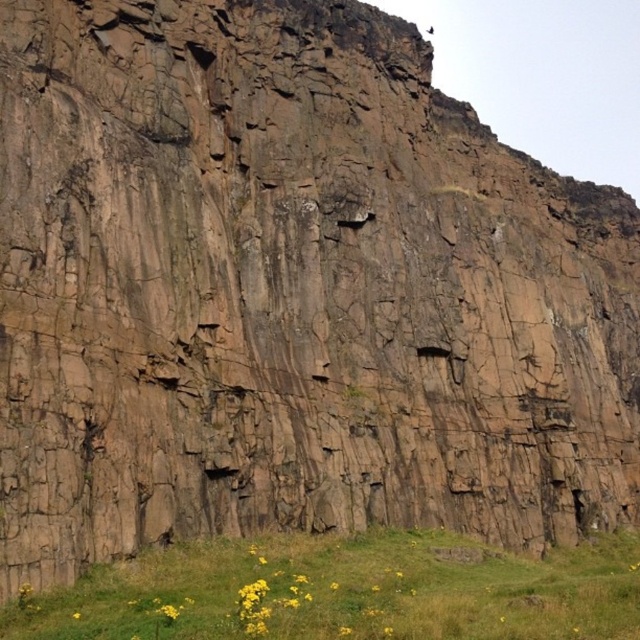
Question: Is green grass at lower center to the right of yellow matte flower at lower center from the viewer's perspective?

Choices:
 (A) yes
 (B) no

Answer: (A)

Question: Among these objects, which one is nearest to the camera?

Choices:
 (A) yellow matte flower at lower center
 (B) green grass at lower center

Answer: (B)

Question: Is the position of green grass at lower center less distant than that of yellow matte flower at lower center?

Choices:
 (A) yes
 (B) no

Answer: (A)

Question: Which point is farther to the camera?

Choices:
 (A) (33, 621)
 (B) (173, 605)

Answer: (B)

Question: Can you confirm if green grass at lower center is positioned above yellow matte flower at lower center?

Choices:
 (A) yes
 (B) no

Answer: (B)